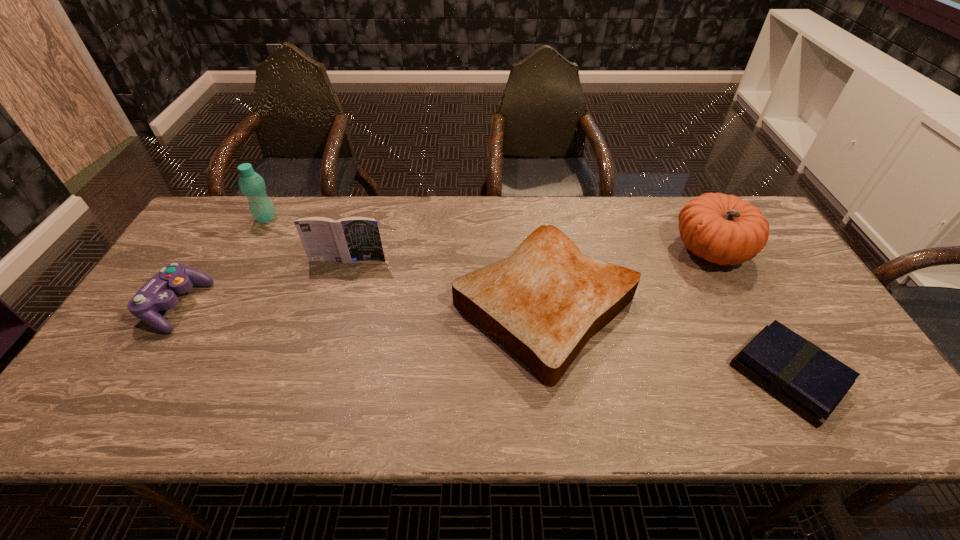
Identify the location of free space that satisfies the following two spatial constraints: 1. on the back side of the pumpkin; 2. on the right side of the leftmost object. This screenshot has width=960, height=540. (212, 249).

The height and width of the screenshot is (540, 960). I want to click on vacant area that satisfies the following two spatial constraints: 1. on the front side of the fourth object from left to right; 2. on the right side of the right book, so click(x=555, y=376).